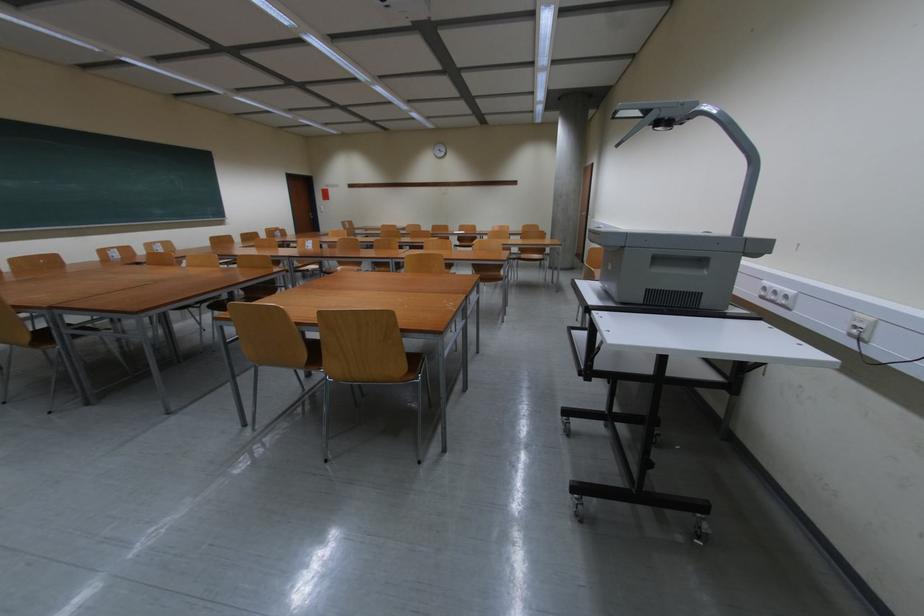
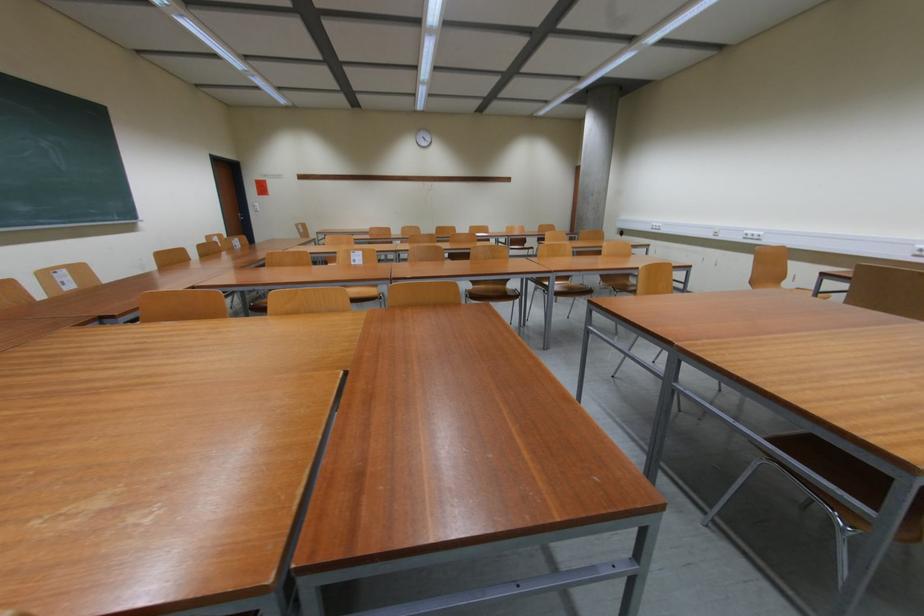
What movement of the cameraman would produce the second image?

The cameraman walked toward left, forward.